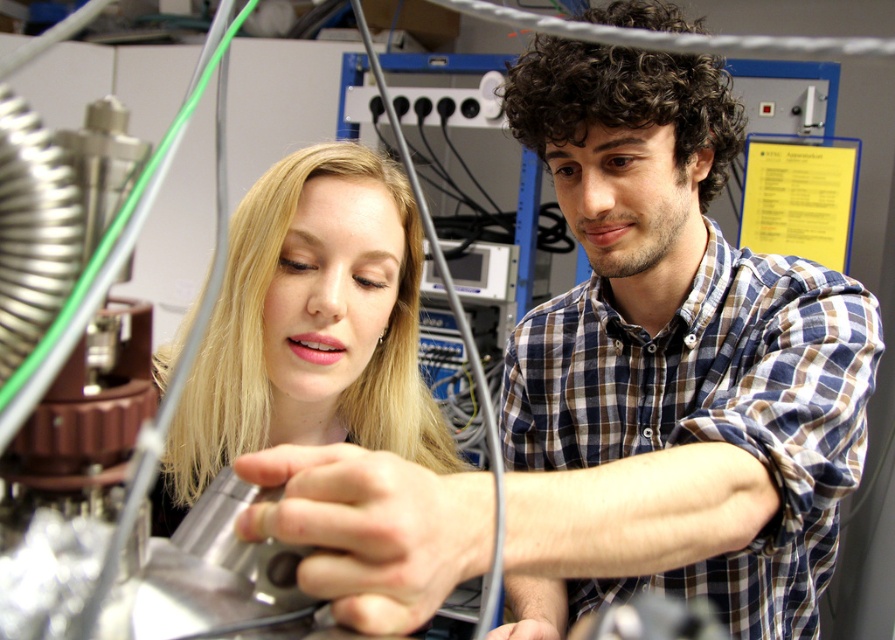
Question: Is blue checkered shirt at center positioned at the back of blonde hair at center?

Choices:
 (A) yes
 (B) no

Answer: (B)

Question: Which point is farther from the camera taking this photo?

Choices:
 (A) (405, 205)
 (B) (827, 419)

Answer: (A)

Question: Which of the following is the farthest from the observer?

Choices:
 (A) (244, 385)
 (B) (812, 598)

Answer: (B)

Question: Does blue checkered shirt at center appear under blonde hair at center?

Choices:
 (A) no
 (B) yes

Answer: (A)

Question: Is blue checkered shirt at center to the right of blonde hair at center from the viewer's perspective?

Choices:
 (A) yes
 (B) no

Answer: (A)